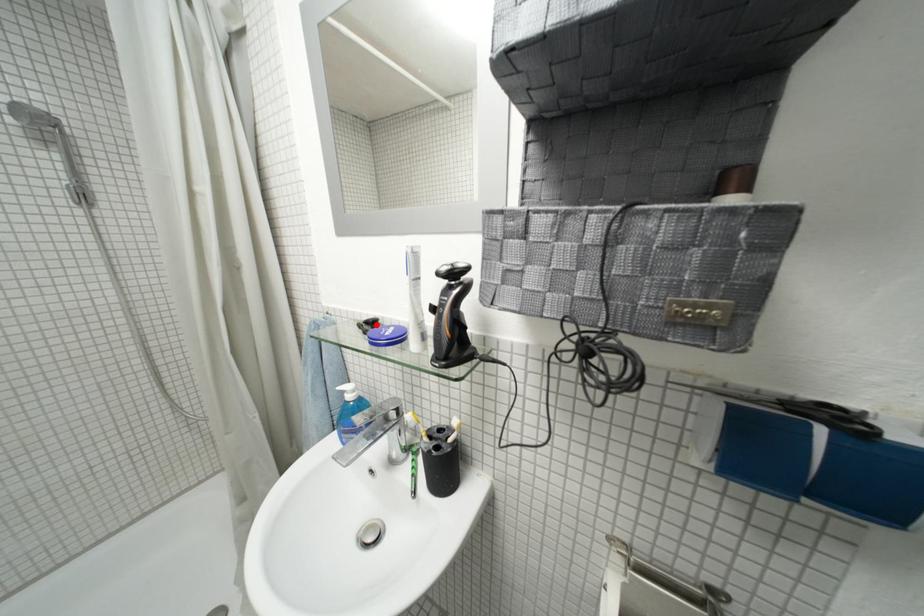
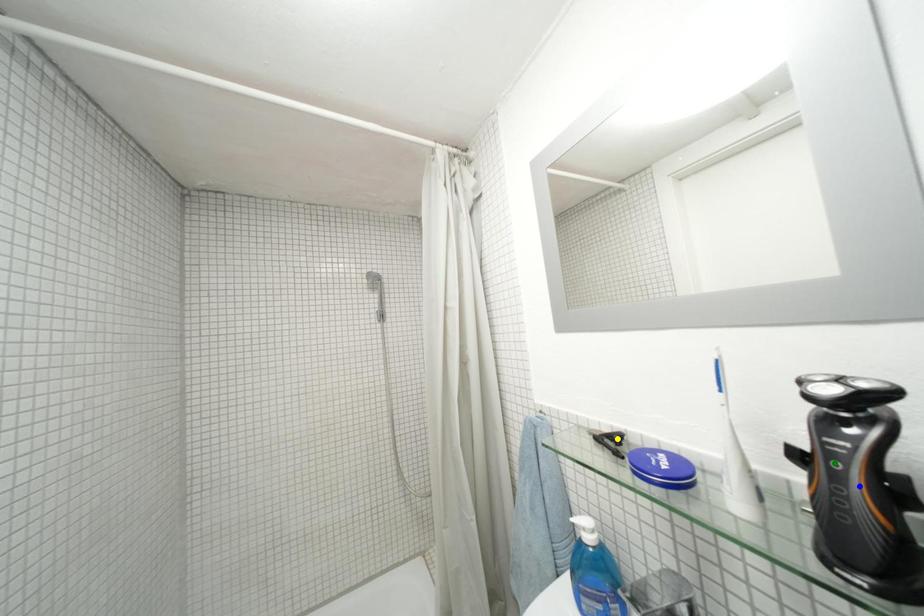
Question: I am providing you with two images of the same scene from different viewpoints. A red point is marked on the first image. You are given multiple points on the second image. Can you choose the point in image 2 that corresponds to the point in image 1?

Choices:
 (A) yellow point
 (B) blue point
 (C) green point

Answer: (A)